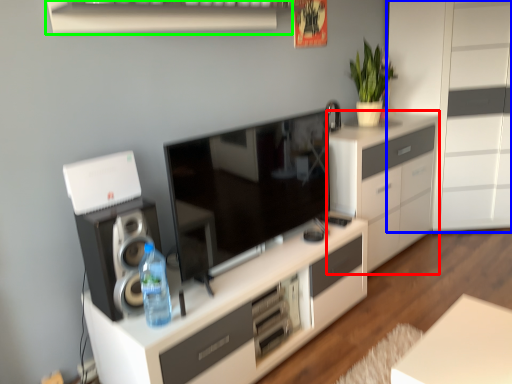
Question: Which is farther away from cabinetry (highlighted by a red box)? chest of drawers (highlighted by a blue box) or shelf (highlighted by a green box)?

Choices:
 (A) chest of drawers
 (B) shelf

Answer: (B)